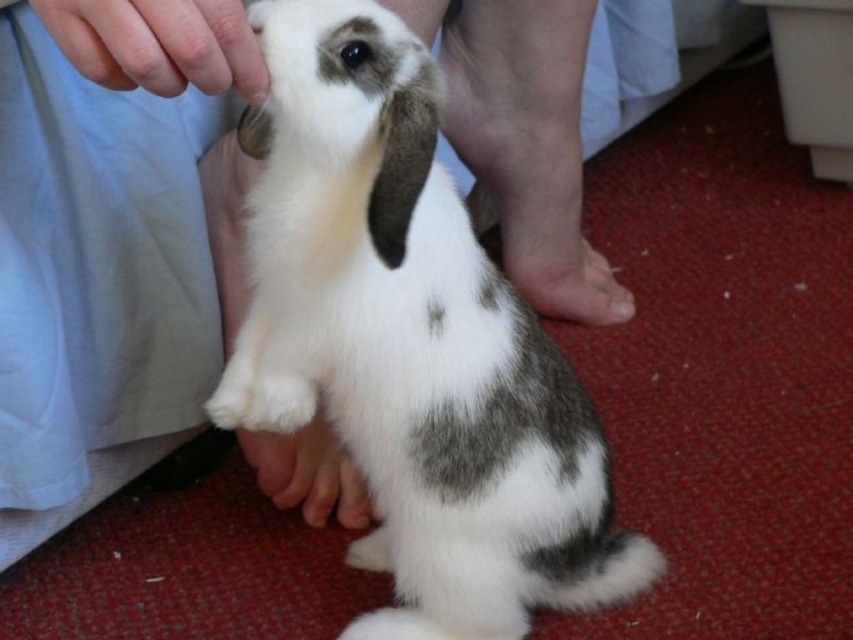
You are a photographer trying to capture the rabbit and the person holding it. You notice two areas of smooth skin at upper left and white soft skin at center in your viewfinder. Which area should you focus on to ensure it appears sharper in the photo?

The smooth skin at upper left is closer to the viewer than the white soft skin at center, so focusing on the smooth skin at upper left will ensure it appears sharper in the photo.

You are a veterinarian examining a rabbit. You notice two areas of skin on the rabbit. One is labeled as smooth skin at upper left and the other as white soft skin at center. From the rabbit handler perspective, which skin area is positioned to the left?

The smooth skin at upper left is positioned to the left of the white soft skin at center.